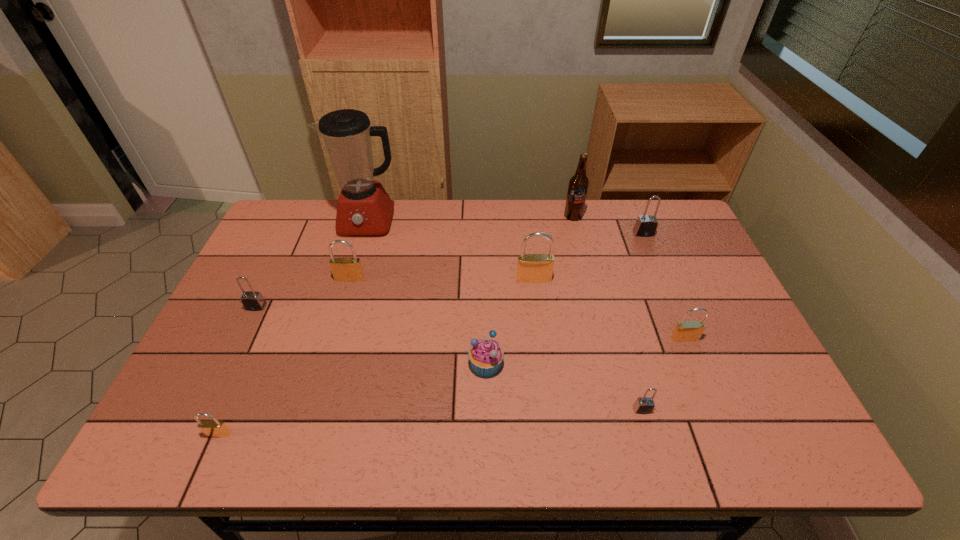
Find the location of a particular element. The image size is (960, 540). the rightmost brass padlock is located at coordinates (685, 331).

What are the coordinates of `the third farthest brass padlock` in the screenshot? It's located at (685, 331).

What are the coordinates of `the third nearest object` in the screenshot? It's located at (486, 355).

Image resolution: width=960 pixels, height=540 pixels. What are the coordinates of `blue muffin` in the screenshot? It's located at [x=486, y=355].

Find the location of a particular element. Image resolution: width=960 pixels, height=540 pixels. the second nearest object is located at coordinates (644, 405).

Locate an element on the screen. The height and width of the screenshot is (540, 960). the fifth padlock from left to right is located at coordinates (644, 405).

The height and width of the screenshot is (540, 960). Identify the location of the nearest padlock. click(215, 428).

Find the location of a particular element. The width and height of the screenshot is (960, 540). the leftmost brass padlock is located at coordinates (215, 428).

Identify the location of free location located 0.300m on the front of the blender near the controls. (343, 308).

Where is `blank space located on the label of the beer bottle`? The image size is (960, 540). blank space located on the label of the beer bottle is located at coordinates (579, 240).